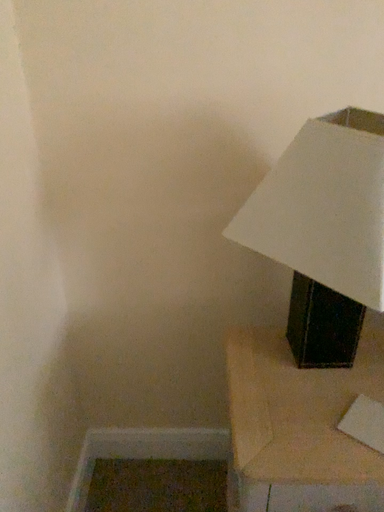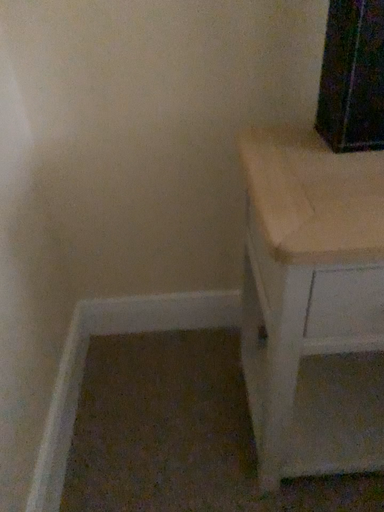
Question: How did the camera likely rotate when shooting the video?

Choices:
 (A) rotated downward
 (B) rotated upward

Answer: (A)